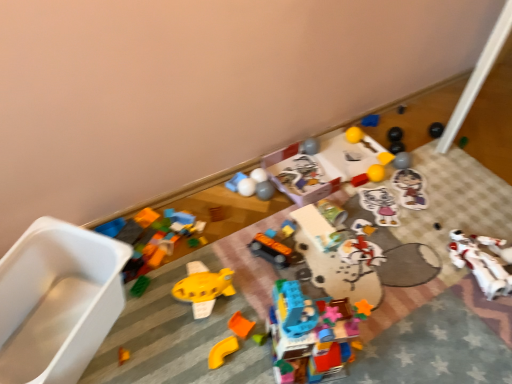
Where is `vacant space that's between white plastic container at left, which is counted as the first toy, starting from the left, and matte black car at center, the eighth toy positioned from the left`? Image resolution: width=512 pixels, height=384 pixels. vacant space that's between white plastic container at left, which is counted as the first toy, starting from the left, and matte black car at center, the eighth toy positioned from the left is located at coordinates (172, 303).